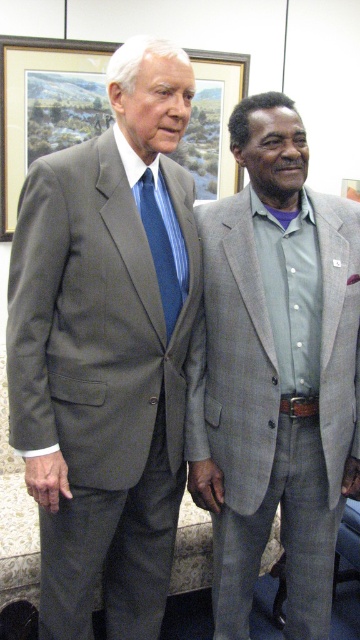
Question: Which object is closer to the camera taking this photo?

Choices:
 (A) gray textured suit at center
 (B) matte gray suit at left
 (C) brushed metal picture frame at upper center
 (D) blue striped tie at center

Answer: (B)

Question: Which point is closer to the camera taking this photo?

Choices:
 (A) (210, 112)
 (B) (171, 221)

Answer: (B)

Question: Which of these objects is positioned farthest from the matte gray suit at left?

Choices:
 (A) brushed metal picture frame at upper center
 (B) blue striped tie at center
 (C) gray textured suit at center

Answer: (A)

Question: Can you confirm if matte gray suit at left is positioned below gray textured suit at center?

Choices:
 (A) no
 (B) yes

Answer: (A)

Question: Is matte gray suit at left to the left of gray textured suit at center from the viewer's perspective?

Choices:
 (A) no
 (B) yes

Answer: (B)

Question: Where is matte gray suit at left located in relation to brushed metal picture frame at upper center in the image?

Choices:
 (A) right
 (B) left

Answer: (A)